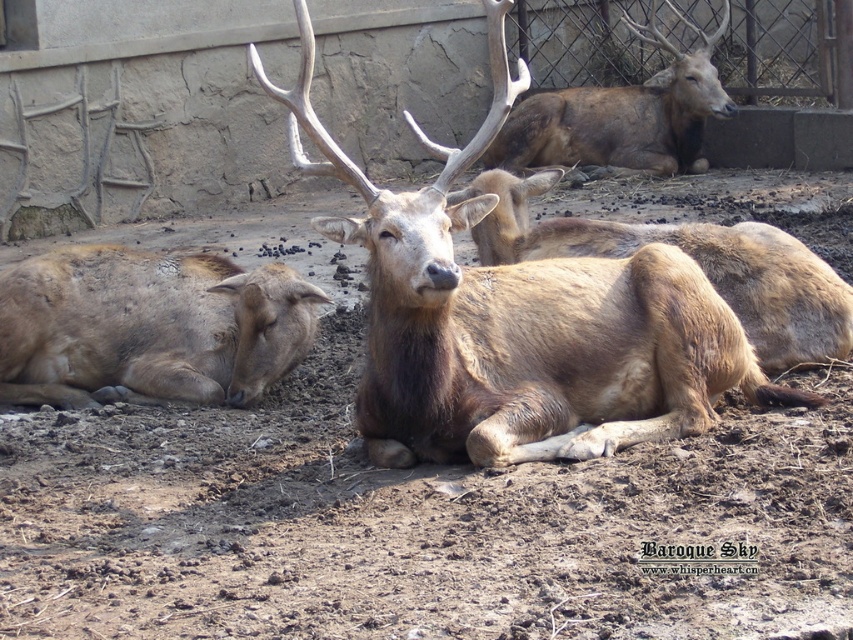
Question: Which point is farther to the camera?

Choices:
 (A) (157, 326)
 (B) (519, 218)
 (C) (560, 147)

Answer: (C)

Question: Does brown fuzzy deer at center appear on the right side of brown furry deer at upper center?

Choices:
 (A) yes
 (B) no

Answer: (B)

Question: Considering the relative positions of brown fuzzy deer at lower left and brown fuzzy deer at center in the image provided, where is brown fuzzy deer at lower left located with respect to brown fuzzy deer at center?

Choices:
 (A) left
 (B) right

Answer: (A)

Question: Does brown furry deer at center appear on the right side of brown fuzzy deer at center?

Choices:
 (A) yes
 (B) no

Answer: (B)

Question: Which object is farther from the camera taking this photo?

Choices:
 (A) brown furry deer at center
 (B) brown furry deer at upper center
 (C) brown fuzzy deer at center

Answer: (B)

Question: Which of the following is the closest to the observer?

Choices:
 (A) pyautogui.click(x=554, y=221)
 (B) pyautogui.click(x=85, y=324)
 (C) pyautogui.click(x=511, y=99)

Answer: (C)